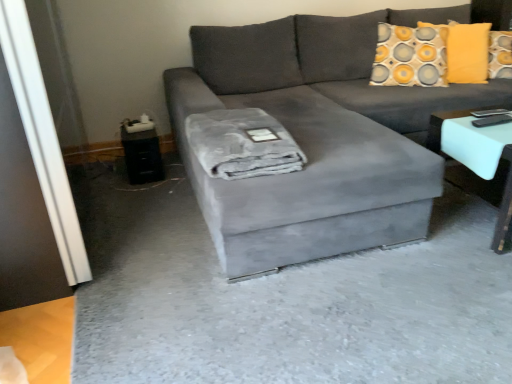
Locate an element on the screen. space that is in front of black plastic side table at lower left is located at coordinates (129, 192).